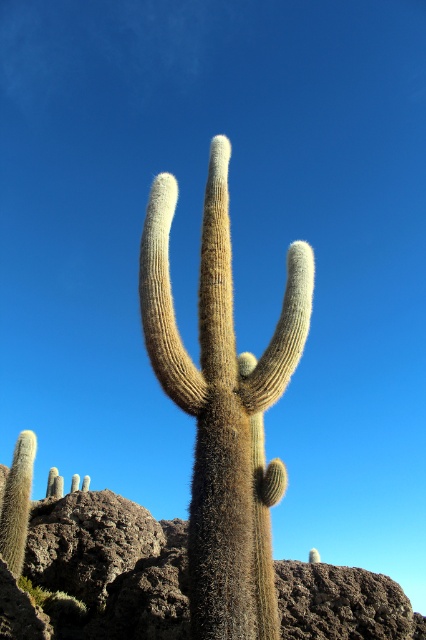
Question: Which object is positioned closest to the fuzzy brown cactus at center?

Choices:
 (A) brown rough rock at center
 (B) green fuzzy cactus at lower left

Answer: (B)

Question: Can you confirm if fuzzy brown cactus at center is positioned to the right of green fuzzy cactus at lower left?

Choices:
 (A) no
 (B) yes

Answer: (B)

Question: Which object is positioned farthest from the green fuzzy cactus at lower left?

Choices:
 (A) brown rough rock at center
 (B) fuzzy brown cactus at center

Answer: (B)

Question: Which of the following is the farthest from the observer?

Choices:
 (A) (22, 476)
 (B) (172, 598)
 (C) (232, 484)

Answer: (A)

Question: Considering the relative positions of fuzzy brown cactus at center and green fuzzy cactus at lower left in the image provided, where is fuzzy brown cactus at center located with respect to green fuzzy cactus at lower left?

Choices:
 (A) left
 (B) right

Answer: (B)

Question: Can you confirm if fuzzy brown cactus at center is positioned to the left of green fuzzy cactus at lower left?

Choices:
 (A) yes
 (B) no

Answer: (B)